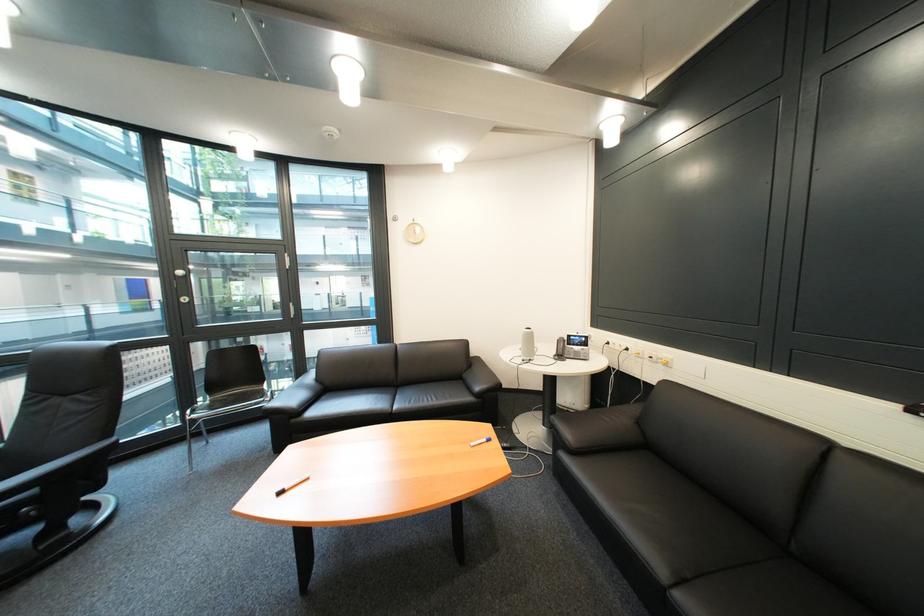
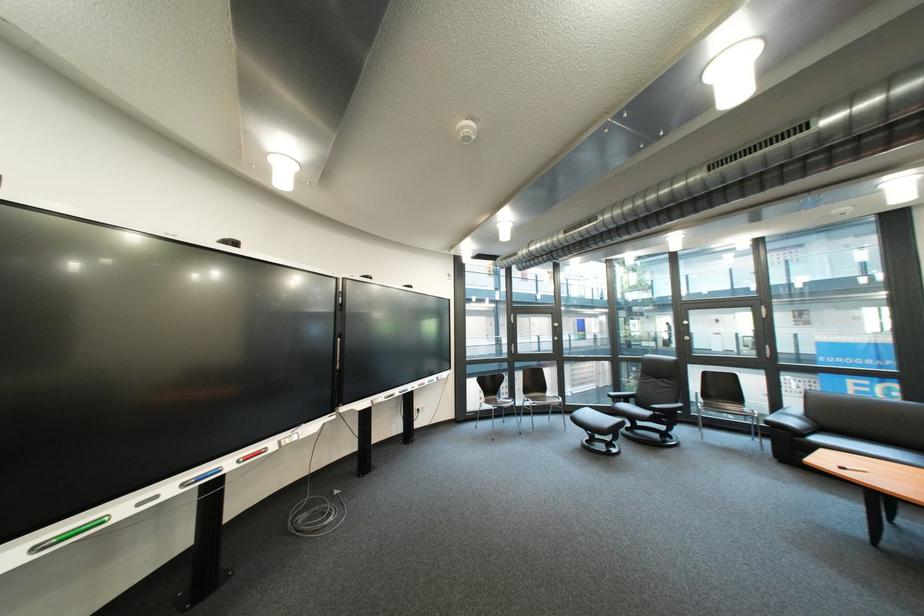
Find the pixel in the second image that matches (300,488) in the first image.

(862, 469)